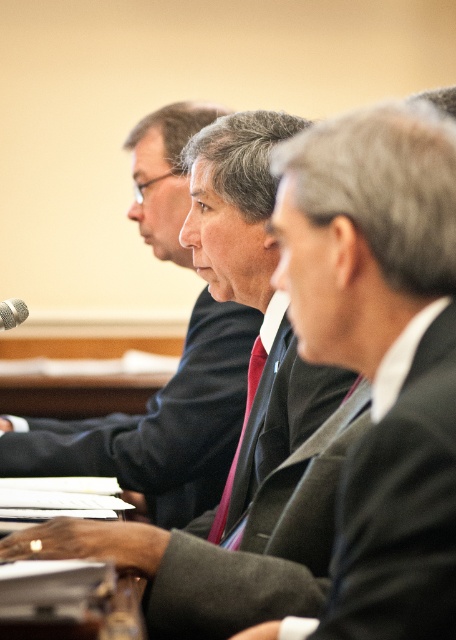
Question: Is silky red tie at center thinner than silver metallic microphone at left?

Choices:
 (A) yes
 (B) no

Answer: (B)

Question: In this image, where is dark gray suit at center located relative to silky red tie at center?

Choices:
 (A) left
 (B) right

Answer: (A)

Question: Which point is closer to the camera?

Choices:
 (A) silky red tie at center
 (B) silver metallic microphone at left

Answer: (A)

Question: Can you confirm if dark gray suit at center is thinner than silky red tie at center?

Choices:
 (A) no
 (B) yes

Answer: (A)

Question: Which of the following is the closest to the observer?

Choices:
 (A) (259, 336)
 (B) (0, 310)

Answer: (A)

Question: Estimate the real-world distances between objects in this image. Which object is farther from the matte black suit at center?

Choices:
 (A) dark gray suit at center
 (B) silky red tie at center

Answer: (A)